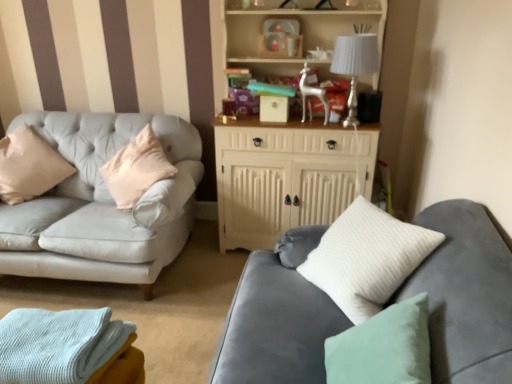
Question: Is velvet gray couch at lower right completely or partially outside of white wood cabinet at upper center?

Choices:
 (A) no
 (B) yes

Answer: (B)

Question: Does velvet gray couch at lower right have a smaller size compared to white wood cabinet at upper center?

Choices:
 (A) yes
 (B) no

Answer: (A)

Question: Is velvet gray couch at lower right positioned in front of white wood cabinet at upper center?

Choices:
 (A) no
 (B) yes

Answer: (B)

Question: Are velvet gray couch at lower right and white wood cabinet at upper center far apart?

Choices:
 (A) yes
 (B) no

Answer: (B)

Question: Is the surface of velvet gray couch at lower right in direct contact with white wood cabinet at upper center?

Choices:
 (A) yes
 (B) no

Answer: (B)

Question: Considering the positions of white fabric lampshade at upper right and white wood cabinet at upper center in the image, is white fabric lampshade at upper right taller or shorter than white wood cabinet at upper center?

Choices:
 (A) short
 (B) tall

Answer: (A)

Question: From the image's perspective, relative to white wood cabinet at upper center, is white fabric lampshade at upper right above or below?

Choices:
 (A) below
 (B) above

Answer: (B)

Question: From a real-world perspective, is white fabric lampshade at upper right positioned above or below white wood cabinet at upper center?

Choices:
 (A) above
 (B) below

Answer: (A)

Question: Relative to white wood cabinet at upper center, is white fabric lampshade at upper right in front or behind?

Choices:
 (A) front
 (B) behind

Answer: (B)

Question: From a real-world perspective, is velvet gray couch at lower right above or below light blue knitted blanket at lower left?

Choices:
 (A) below
 (B) above

Answer: (B)

Question: Is velvet gray couch at lower right wider or thinner than light blue knitted blanket at lower left?

Choices:
 (A) wide
 (B) thin

Answer: (B)

Question: Would you say velvet gray couch at lower right is to the left or to the right of light blue knitted blanket at lower left in the picture?

Choices:
 (A) left
 (B) right

Answer: (B)

Question: Which is correct: velvet gray couch at lower right is inside light blue knitted blanket at lower left, or outside of it?

Choices:
 (A) outside
 (B) inside

Answer: (A)

Question: In terms of height, does white wood cabinet at upper center look taller or shorter compared to white fabric lampshade at upper right?

Choices:
 (A) short
 (B) tall

Answer: (B)

Question: In the image, is white wood cabinet at upper center on the left side or the right side of white fabric lampshade at upper right?

Choices:
 (A) right
 (B) left

Answer: (B)